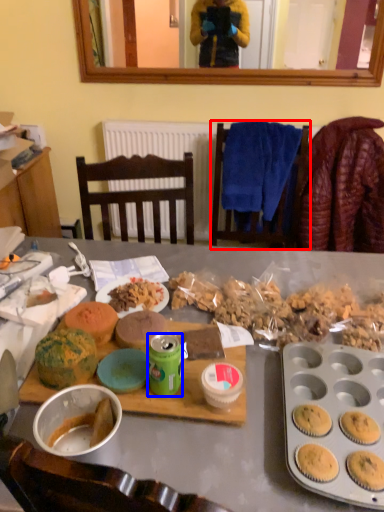
Question: Which point is closer to the camera, chair (highlighted by a red box) or coffee cup (highlighted by a blue box)?

Choices:
 (A) chair
 (B) coffee cup

Answer: (B)